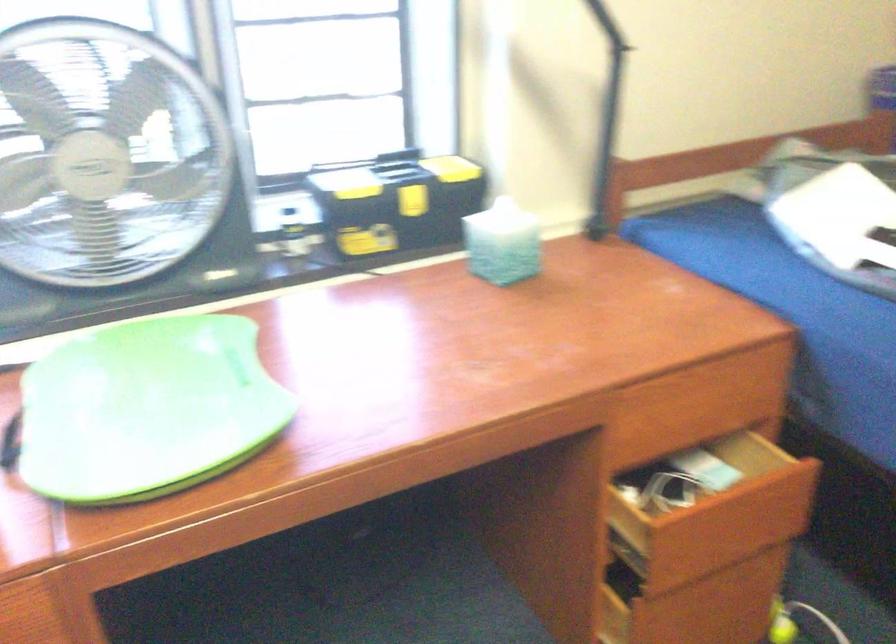
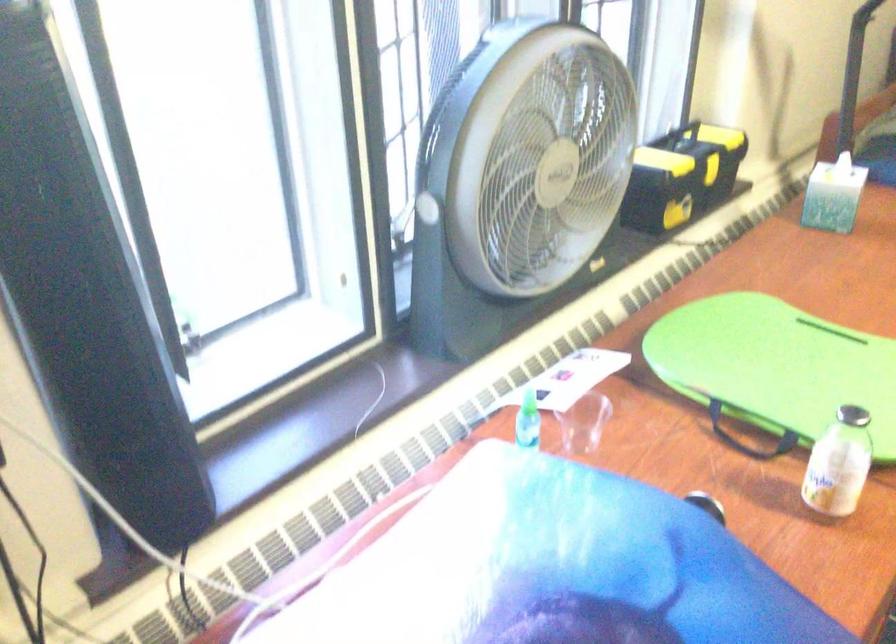
Question: In a continuous first-person perspective shot, in which direction is the camera moving?

Choices:
 (A) Left
 (B) Right
 (C) Forward
 (D) Backward

Answer: (A)